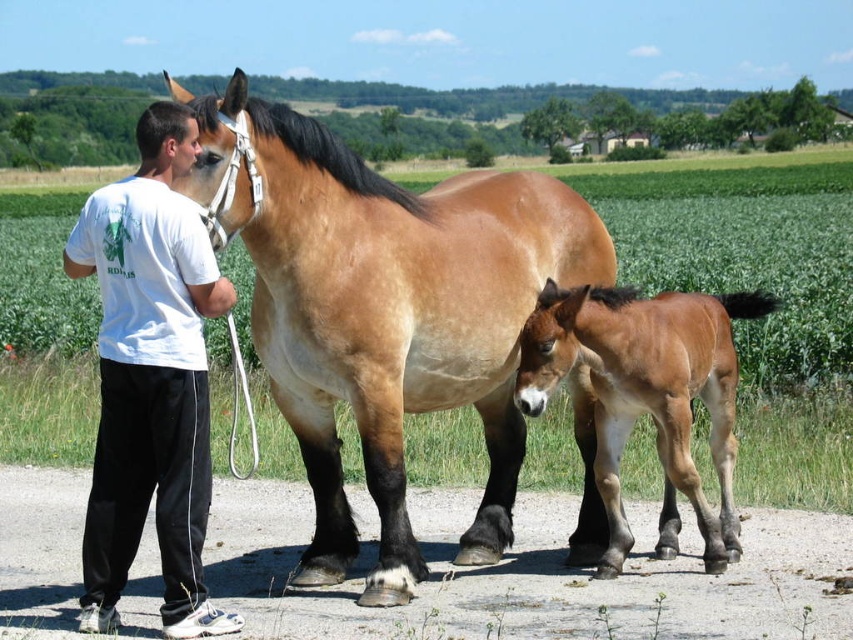
Question: Which point appears closest to the camera in this image?

Choices:
 (A) (x=680, y=438)
 (B) (x=444, y=346)
 (C) (x=91, y=509)

Answer: (C)

Question: From the image, what is the correct spatial relationship of brown glossy horse at center in relation to white cotton t-shirt at left?

Choices:
 (A) below
 (B) above

Answer: (B)

Question: Considering the relative positions of brown glossy horse at center and white cotton t-shirt at left in the image provided, where is brown glossy horse at center located with respect to white cotton t-shirt at left?

Choices:
 (A) above
 (B) below

Answer: (A)

Question: Which object is closer to the camera taking this photo?

Choices:
 (A) brown glossy horse at center
 (B) brown glossy foal at lower right
 (C) white cotton t-shirt at left

Answer: (C)

Question: Is brown glossy horse at center above white cotton t-shirt at left?

Choices:
 (A) yes
 (B) no

Answer: (A)

Question: Estimate the real-world distances between objects in this image. Which object is closer to the white cotton t-shirt at left?

Choices:
 (A) brown glossy horse at center
 (B) brown glossy foal at lower right

Answer: (A)